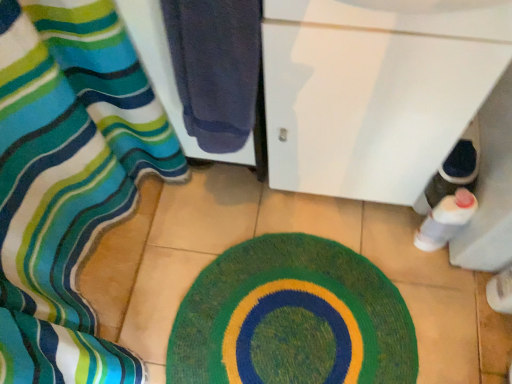
Question: Considering their positions, is white glossy bottle at lower right located in front of or behind silky striped fabric at left?

Choices:
 (A) front
 (B) behind

Answer: (A)

Question: From a real-world perspective, is white glossy bottle at lower right positioned above or below silky striped fabric at left?

Choices:
 (A) below
 (B) above

Answer: (B)

Question: Which of these objects is positioned farthest from the dark blue towel at left?

Choices:
 (A) silky striped fabric at left
 (B) white glossy bottle at lower right
 (C) green knitted bath mat at center
 (D) white glossy cabinet at lower right

Answer: (B)

Question: Which is nearer to the dark blue towel at left?

Choices:
 (A) white glossy bottle at lower right
 (B) green knitted bath mat at center
 (C) silky striped fabric at left
 (D) white glossy cabinet at lower right

Answer: (D)